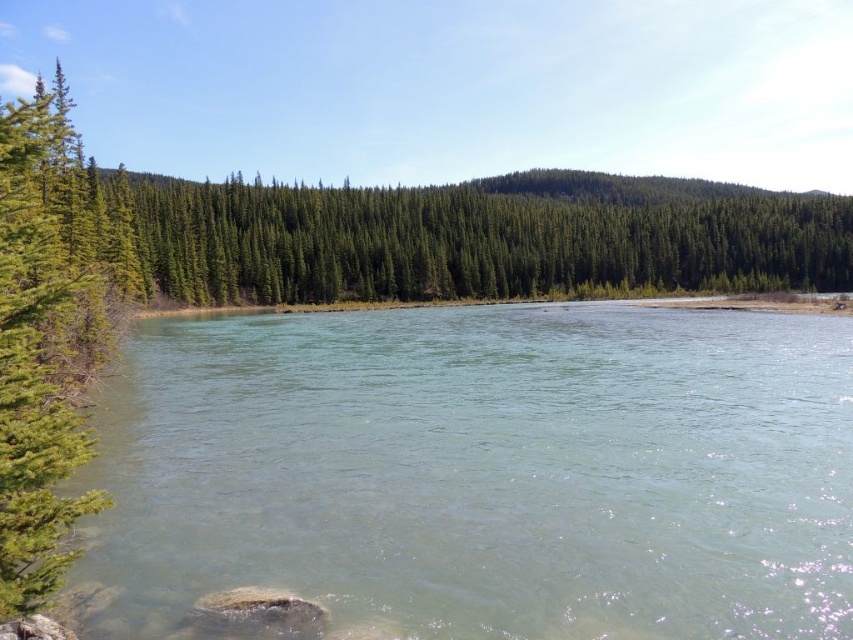
Which of these two, clear water at center or green matte forest at center, stands shorter?

With less height is clear water at center.

Which is behind, point (219, 468) or point (619, 264)?

Point (619, 264)

This screenshot has height=640, width=853. I want to click on clear water at center, so click(x=480, y=472).

Does green matte forest at center have a smaller size compared to green textured pine tree at left?

No, green matte forest at center is not smaller than green textured pine tree at left.

Is green matte forest at center in front of green textured pine tree at left?

No, green matte forest at center is further to the viewer.

The image size is (853, 640). Find the location of `green matte forest at center`. green matte forest at center is located at coordinates [483, 237].

Where is `green matte forest at center`? The height and width of the screenshot is (640, 853). green matte forest at center is located at coordinates (483, 237).

This screenshot has height=640, width=853. What do you see at coordinates (480, 472) in the screenshot?
I see `clear water at center` at bounding box center [480, 472].

Who is higher up, clear water at center or green textured pine tree at left?

green textured pine tree at left is above.

Is point (807, 612) closer to camera compared to point (39, 100)?

Yes, point (807, 612) is in front of point (39, 100).

This screenshot has height=640, width=853. What are the coordinates of `clear water at center` in the screenshot? It's located at (480, 472).